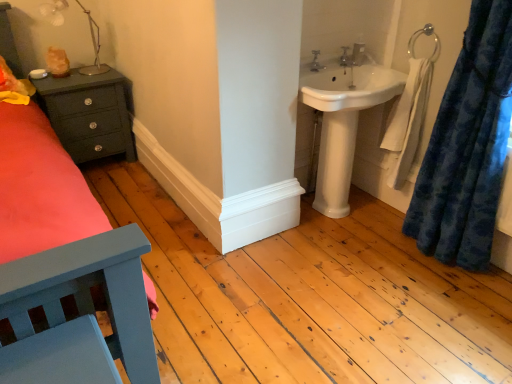
Question: Can metallic silver lamp at upper left be found inside white glossy sink at upper right?

Choices:
 (A) yes
 (B) no

Answer: (B)

Question: From a real-world perspective, is white glossy sink at upper right positioned under metallic silver lamp at upper left based on gravity?

Choices:
 (A) no
 (B) yes

Answer: (B)

Question: Is white glossy sink at upper right to the left of metallic silver lamp at upper left from the viewer's perspective?

Choices:
 (A) no
 (B) yes

Answer: (A)

Question: Is white glossy sink at upper right with metallic silver lamp at upper left?

Choices:
 (A) yes
 (B) no

Answer: (B)

Question: Is white glossy sink at upper right wider than metallic silver lamp at upper left?

Choices:
 (A) yes
 (B) no

Answer: (A)

Question: Is white glossy sink at upper right taller than metallic silver lamp at upper left?

Choices:
 (A) no
 (B) yes

Answer: (A)

Question: From the image's perspective, is matte dark green nightstand at left under blue plush curtain at right?

Choices:
 (A) yes
 (B) no

Answer: (B)

Question: Is matte dark green nightstand at left completely or partially outside of blue plush curtain at right?

Choices:
 (A) yes
 (B) no

Answer: (A)

Question: Can you confirm if matte dark green nightstand at left is smaller than blue plush curtain at right?

Choices:
 (A) yes
 (B) no

Answer: (A)

Question: From the image's perspective, does matte dark green nightstand at left appear higher than blue plush curtain at right?

Choices:
 (A) yes
 (B) no

Answer: (A)

Question: Is matte dark green nightstand at left shorter than blue plush curtain at right?

Choices:
 (A) yes
 (B) no

Answer: (A)

Question: Does matte dark green nightstand at left appear on the left side of blue plush curtain at right?

Choices:
 (A) yes
 (B) no

Answer: (A)

Question: Is matte silver tap at upper center, which is the second tap from front to back, bigger than matte silver tap at upper center, the second tap viewed from the back?

Choices:
 (A) no
 (B) yes

Answer: (A)